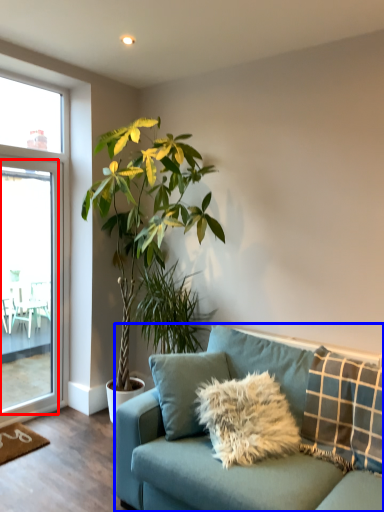
Question: Which point is further to the camera, screen door (highlighted by a red box) or studio couch (highlighted by a blue box)?

Choices:
 (A) screen door
 (B) studio couch

Answer: (A)